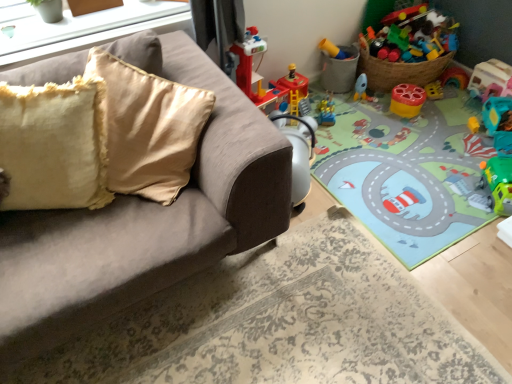
Find the location of a particular element. Image resolution: width=512 pixels, height=384 pixels. empty space that is in between green plastic toy car at lower right, which is the 4th toy in left-to-right order, and matte plastic bucket at upper right, which ranks as the fifth toy in right-to-left order is located at coordinates pos(415,140).